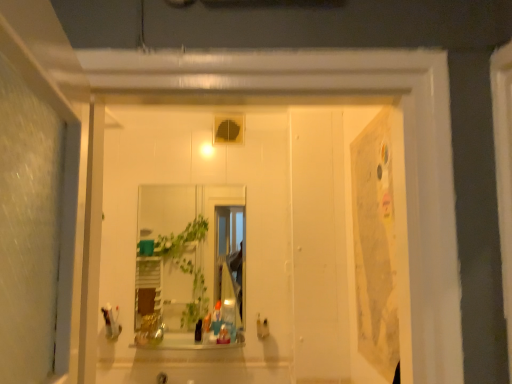
Identify the location of clear glass mirror at center. (179, 253).

The image size is (512, 384). Describe the element at coordinates (179, 253) in the screenshot. I see `clear glass mirror at center` at that location.

The height and width of the screenshot is (384, 512). Identify the location of clear glass mirror at center. (179, 253).